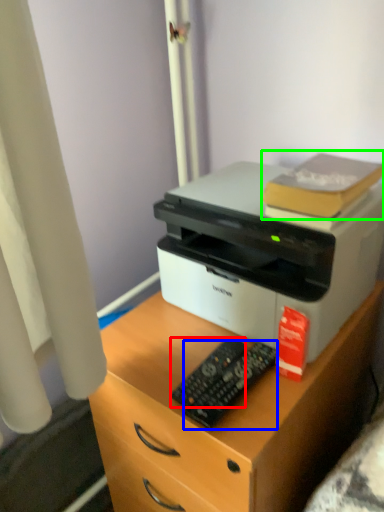
Question: Which object is positioned closest to control (highlighted by a red box)? Select from control (highlighted by a blue box) and book (highlighted by a green box).

Choices:
 (A) control
 (B) book

Answer: (A)